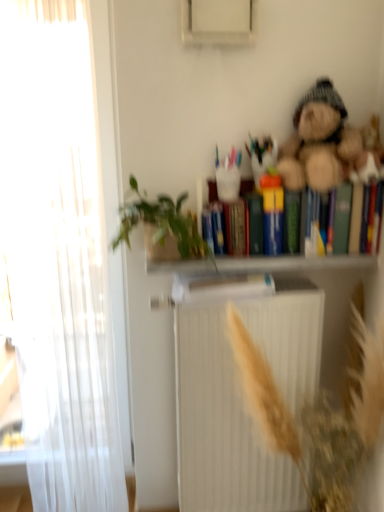
Where is `vacant area on top of white matte radiator at center (from a real-world perspective)`? The height and width of the screenshot is (512, 384). vacant area on top of white matte radiator at center (from a real-world perspective) is located at coordinates (266, 296).